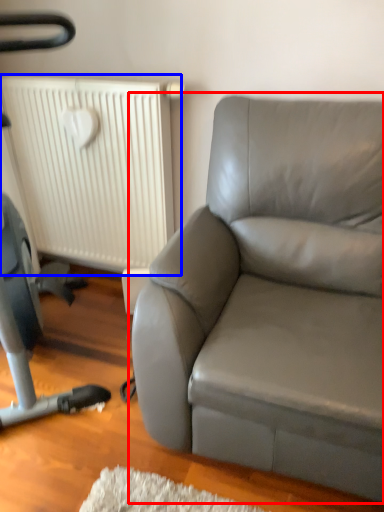
Question: Among these objects, which one is farthest to the camera, studio couch (highlighted by a red box) or radiator (highlighted by a blue box)?

Choices:
 (A) studio couch
 (B) radiator

Answer: (B)